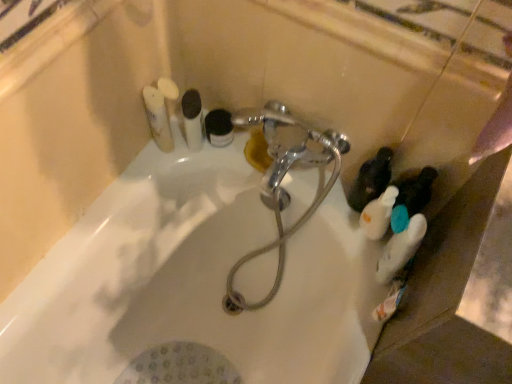
In order to click on vacant area that lies to the right of black matte jar at upper center, the 4th toiletry from the left in this screenshot , I will do `click(266, 164)`.